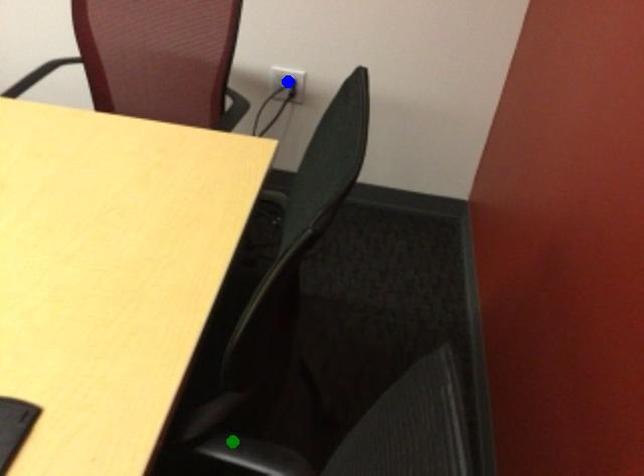
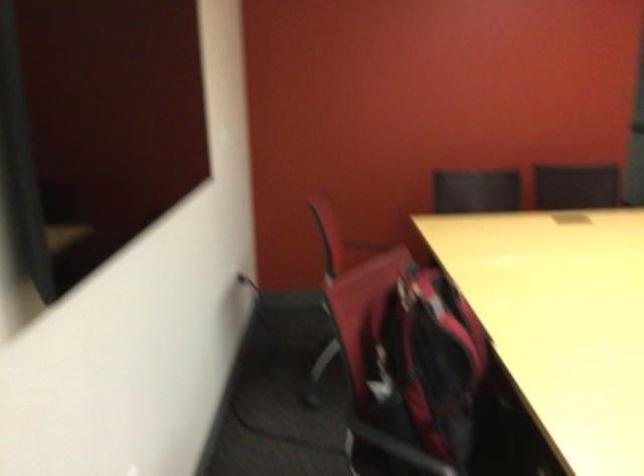
I am providing you with two images of the same scene from different viewpoints. Three points are marked in image1. Which point corresponds to a part or object that is occluded in image2?In image1, three points are marked. Which of them correspond to a part or object that is occluded in image2?Among the three points shown in image1, which one corresponds to a part or object that is no longer visible due to occlusion in image2?

yellow point, blue point, green point